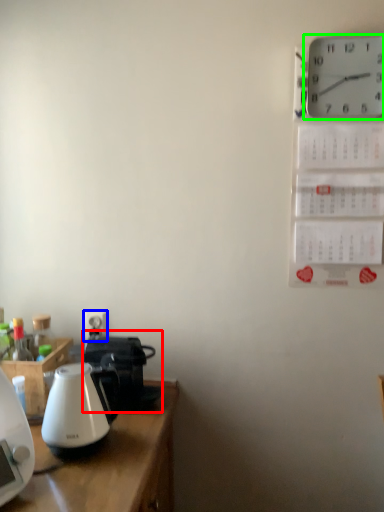
Question: Which is farther away from coffeepot (highlighted by a red box)? electric outlet (highlighted by a blue box) or wall clock (highlighted by a green box)?

Choices:
 (A) electric outlet
 (B) wall clock

Answer: (B)